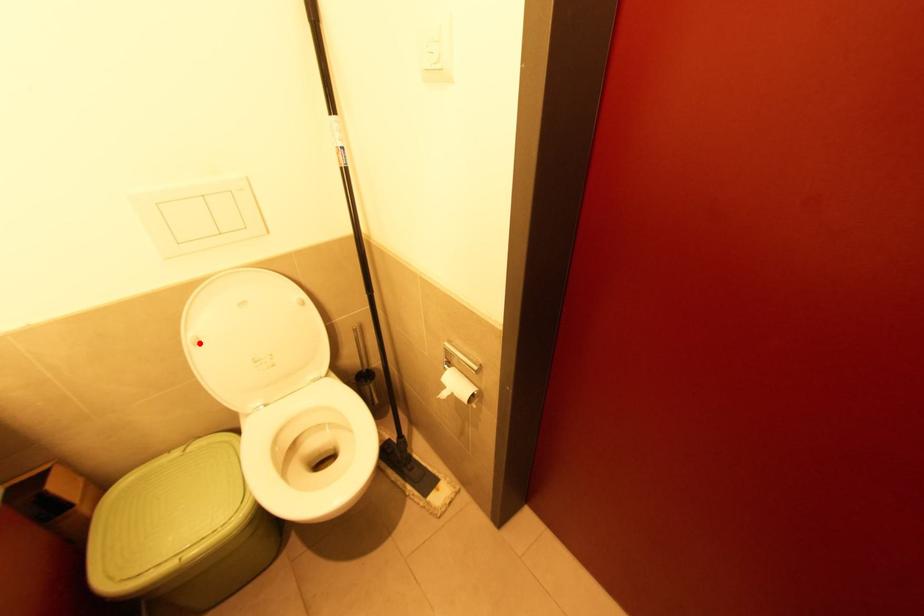
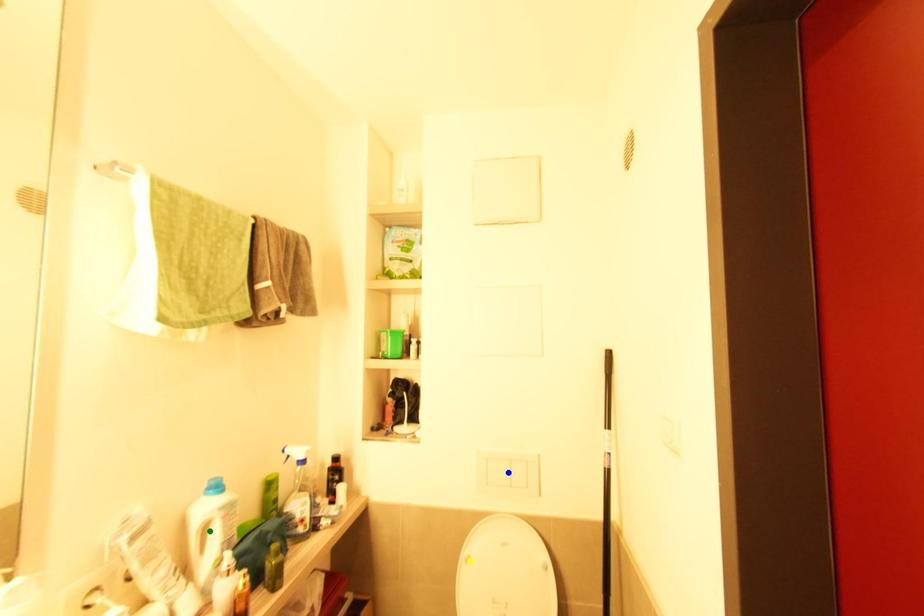
Question: I am providing you with two images of the same scene from different viewpoints. A red point is marked on the first image. You are given multiple points on the second image. In image 2, which mark is for the same physical point as the one in image 1?

Choices:
 (A) blue point
 (B) green point
 (C) yellow point

Answer: (C)